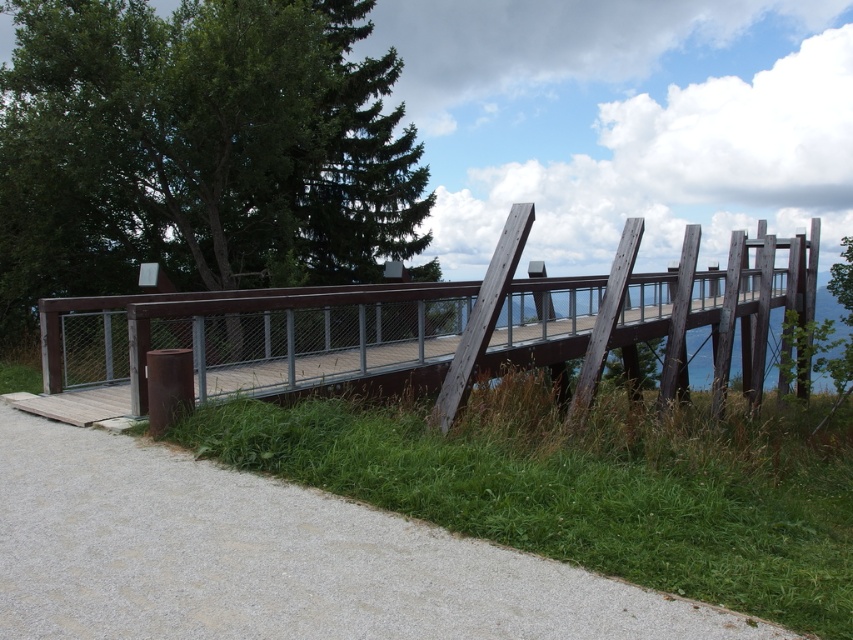
Question: Where is gravel at lower left located in relation to brown wooden bridge at center in the image?

Choices:
 (A) left
 (B) right

Answer: (A)

Question: Which object appears closest to the camera in this image?

Choices:
 (A) brown wooden bridge at center
 (B) gravel at lower left

Answer: (B)

Question: Does gravel at lower left have a lesser width compared to brown wooden bridge at center?

Choices:
 (A) no
 (B) yes

Answer: (B)

Question: Which point is farther from the camera taking this photo?

Choices:
 (A) (57, 324)
 (B) (770, 621)

Answer: (A)

Question: Does gravel at lower left have a greater width compared to brown wooden bridge at center?

Choices:
 (A) yes
 (B) no

Answer: (B)